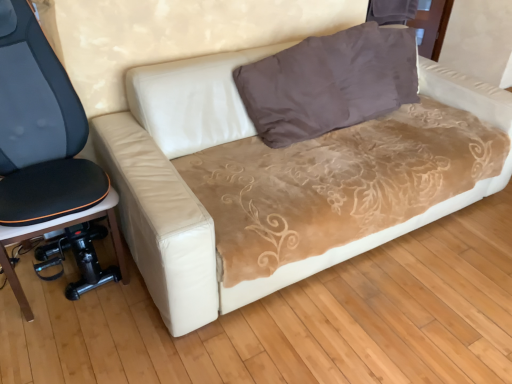
What are the coordinates of `free region under black fabric office chair at left (from a real-world perspective)` in the screenshot? It's located at (51, 275).